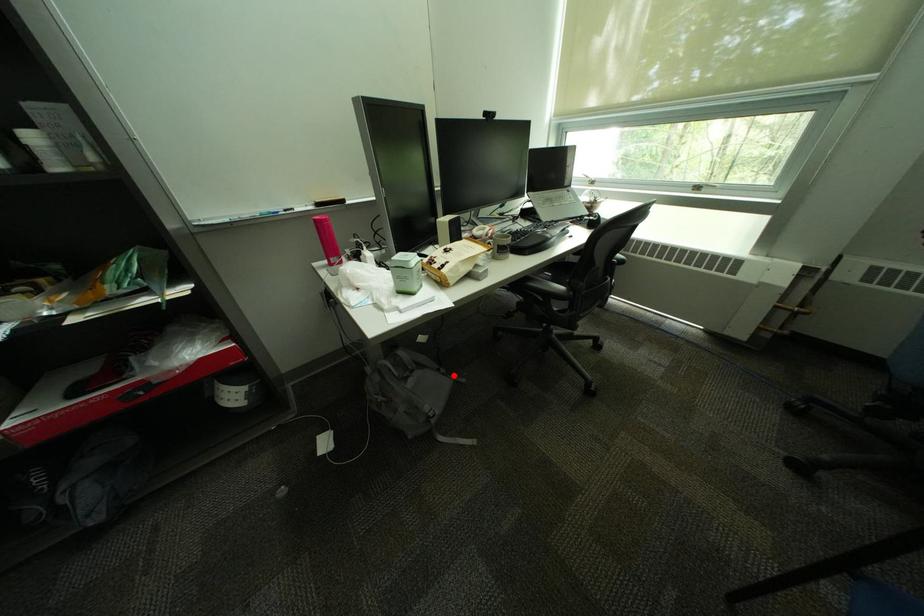
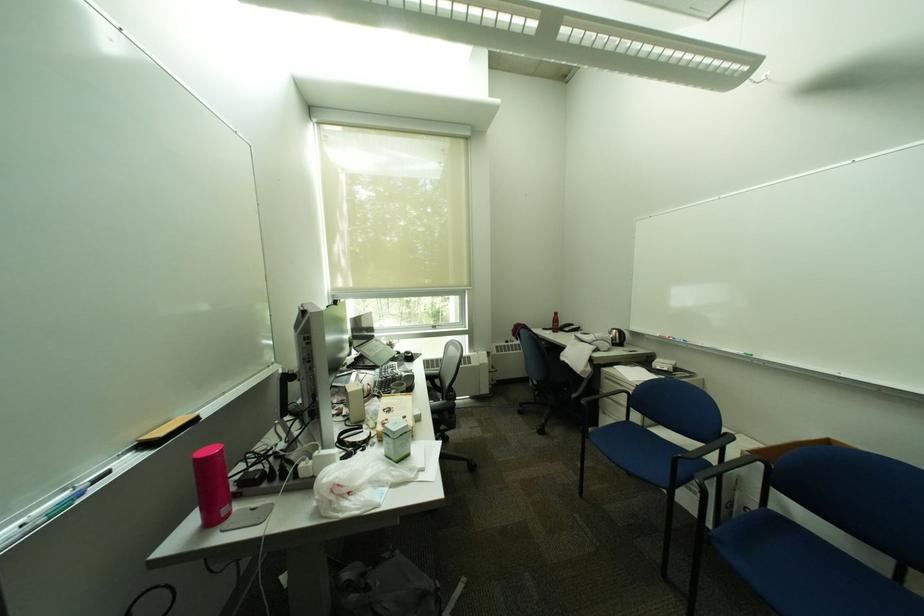
Find the pixel in the second image that matches the highlighted location in the first image.

(400, 560)